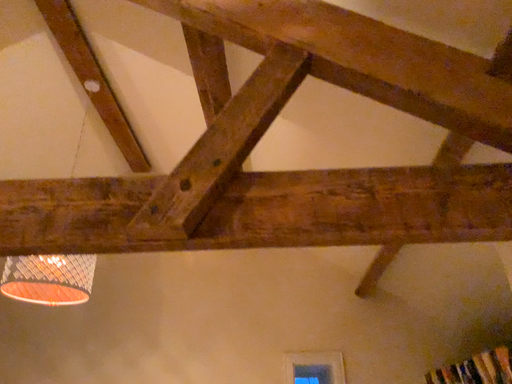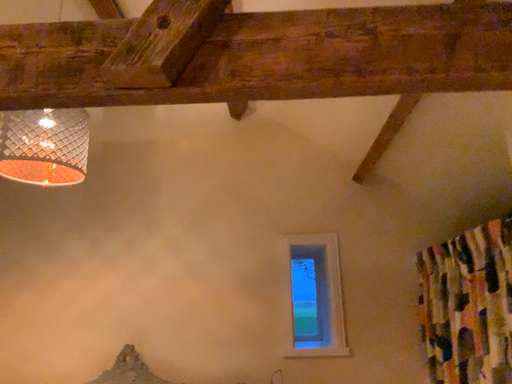
Question: Which way did the camera rotate in the video?

Choices:
 (A) rotated downward
 (B) rotated upward

Answer: (A)